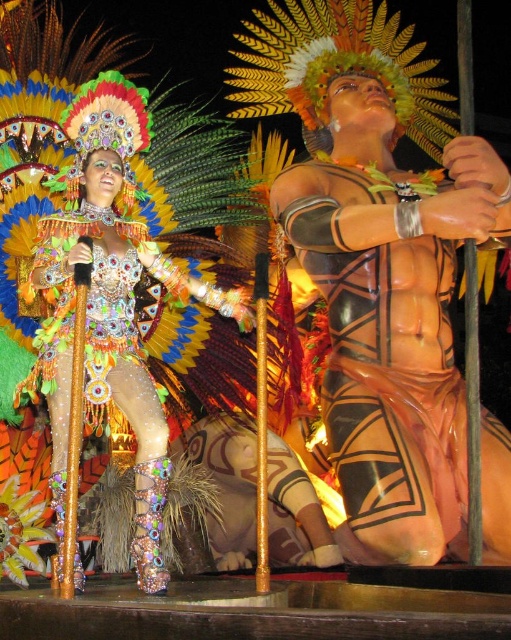
Who is higher up, matte orange body paint at center or shiny sequined dress at center?

shiny sequined dress at center is above.

Is matte orange body paint at center smaller than shiny sequined dress at center?

Correct, matte orange body paint at center occupies less space than shiny sequined dress at center.

Which is behind, point (324, 257) or point (64, 237)?

Positioned behind is point (324, 257).

Image resolution: width=511 pixels, height=640 pixels. What are the coordinates of `matte orange body paint at center` in the screenshot? It's located at (383, 364).